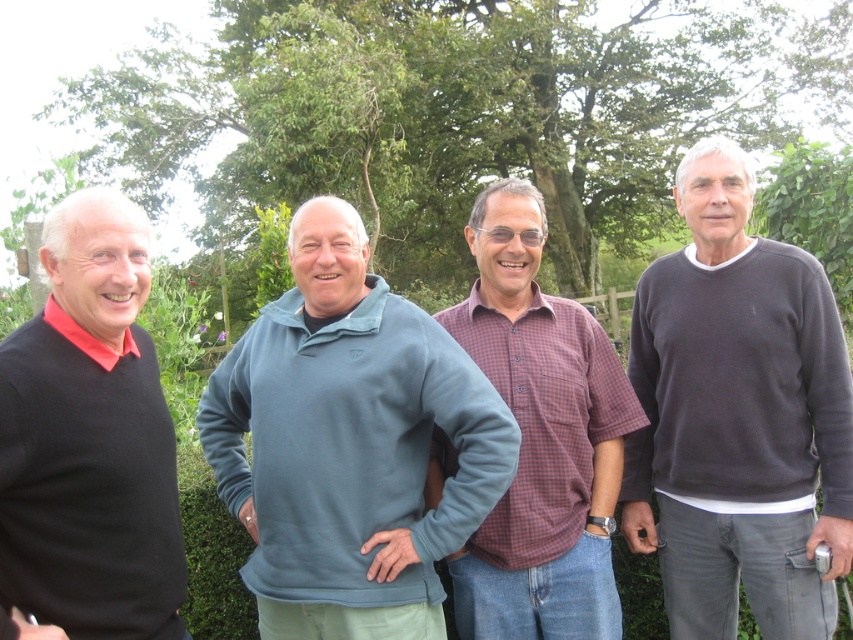
Question: Considering the relative positions of teal fleece at center and dark gray sweater at right in the image provided, where is teal fleece at center located with respect to dark gray sweater at right?

Choices:
 (A) right
 (B) left

Answer: (B)

Question: Which point is farther to the camera?

Choices:
 (A) dark gray sweater at right
 (B) black sweater at left

Answer: (A)

Question: Can you confirm if teal fleece at center is positioned to the left of black sweater at left?

Choices:
 (A) no
 (B) yes

Answer: (A)

Question: Which point is farther to the camera?

Choices:
 (A) (550, 545)
 (B) (328, 525)
 (C) (775, 614)

Answer: (C)

Question: Can you confirm if teal fleece at center is positioned to the right of dark gray sweater at right?

Choices:
 (A) yes
 (B) no

Answer: (B)

Question: Which object is positioned farthest from the teal fleece at center?

Choices:
 (A) plaid cotton shirt at center
 (B) dark gray sweater at right

Answer: (B)